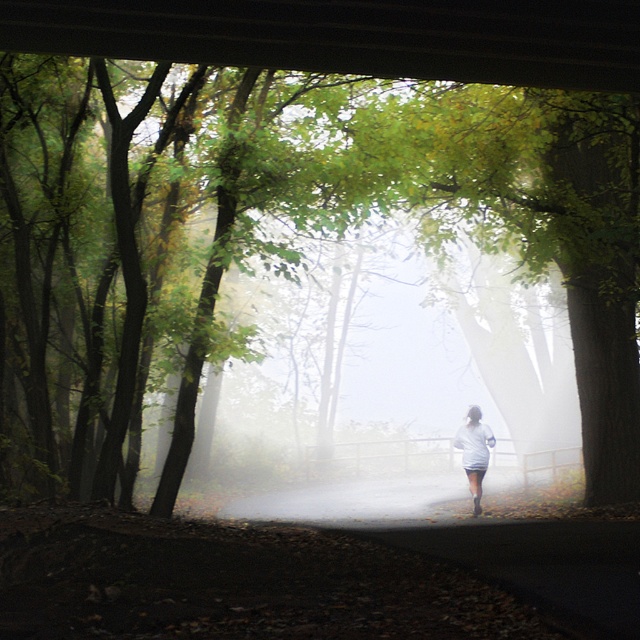
Does green leafy tree at center come behind white matte shirt at center?

No, green leafy tree at center is closer to the viewer.

Does green leafy tree at center have a greater height compared to white matte shirt at center?

Yes, green leafy tree at center is taller than white matte shirt at center.

Describe the element at coordinates (227, 227) in the screenshot. The height and width of the screenshot is (640, 640). I see `green leafy tree at center` at that location.

What are the coordinates of `green leafy tree at center` in the screenshot? It's located at (227, 227).